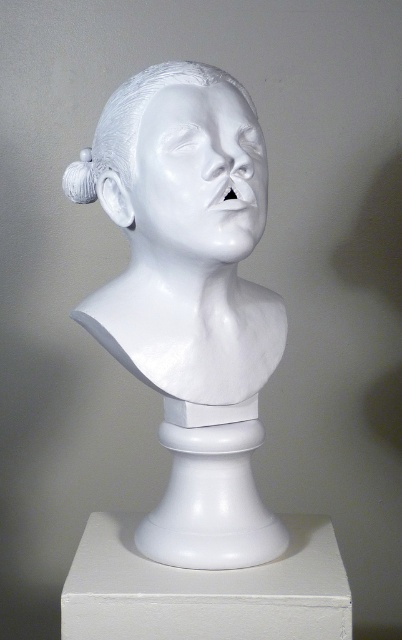
You are an art curator arranging an exhibition. You need to place a label next to the white marble pedestal at center and the white glossy sculpture at center. Since the pedestal is to the right of the sculpture, where should you position the label so it is closer to the sculpture but still visible from the same viewpoint?

The white marble pedestal at center is to the right of the white glossy sculpture at center, so positioning the label to the left side of the pedestal would place it closer to the sculpture while remaining visible from the same viewpoint.

Based on the photo, you are an art curator standing at the entrance of the gallery. You want to place a small plaque with the artist name next to the white glossy bust at center. The plaque must be placed at coordinates between 0.4 and 0.5 on the x and y axes. Can you place the plaque there?

The white glossy bust at center is located at point (x=190, y=298). Since both coordinates fall within the 0.4 to 0.5 range, the plaque can be placed there.

You are an art conservator examining the white plaster bust sculpture. You need to determine if the sculpture is centered on its pedestal. Based on the image, is the white glossy bust at center aligned to the left or right side of the white marble pedestal at center?

The white glossy bust at center is positioned on the left side of the white marble pedestal at center, so it is not centered and is aligned to the left side.